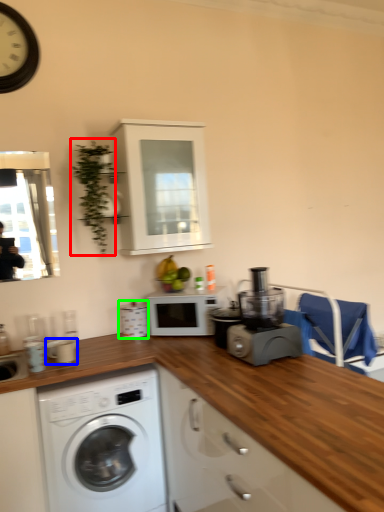
Question: Which object is positioned farthest from plant (highlighted by a red box)? Select from appliance (highlighted by a blue box) and appliance (highlighted by a green box).

Choices:
 (A) appliance
 (B) appliance

Answer: (A)